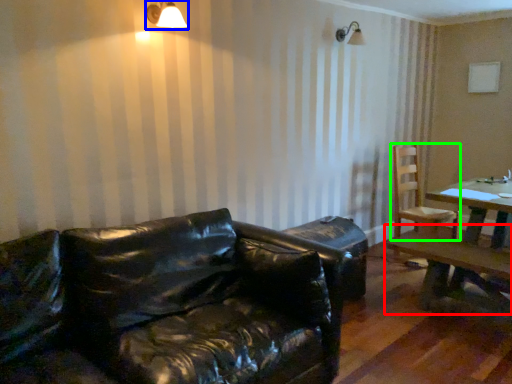
Question: Estimate the real-world distances between objects in this image. Which object is farther from table (highlighted by a red box), light fixture (highlighted by a blue box) or chair (highlighted by a green box)?

Choices:
 (A) light fixture
 (B) chair

Answer: (A)